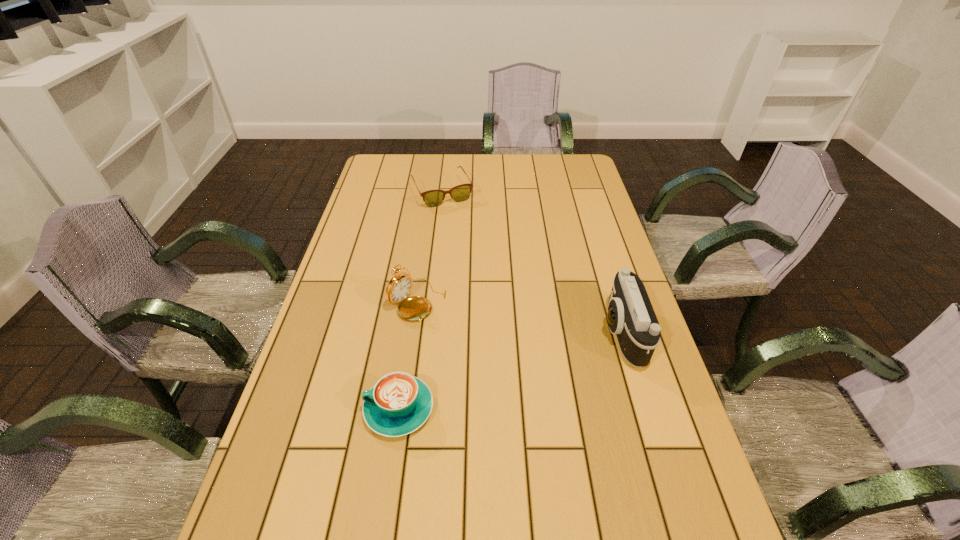
In order to click on vacant space on the desktop that is between the nearest object and the camera and is positioned on the face of the pocket watch in this screenshot , I will do `click(530, 364)`.

Identify the location of free spot on the desktop that is between the nearest object and the rightmost object and is positioned at the front view of the farthest object. This screenshot has width=960, height=540. (535, 362).